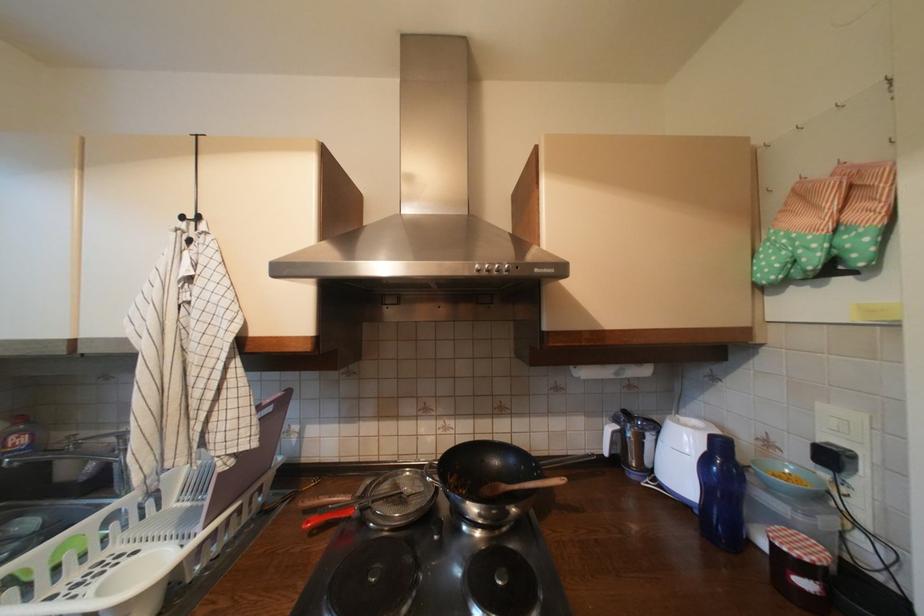
Image resolution: width=924 pixels, height=616 pixels. I want to click on white light switch, so click(x=869, y=431).